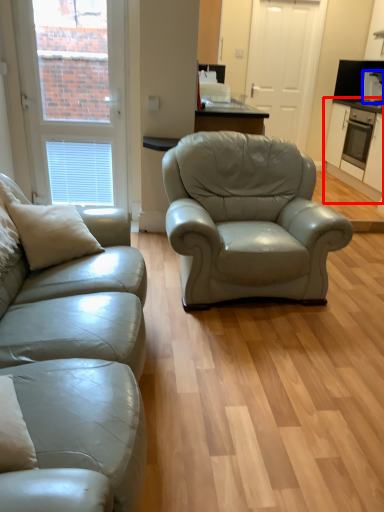
Question: Among these objects, which one is farthest to the camera, cabinetry (highlighted by a red box) or appliance (highlighted by a blue box)?

Choices:
 (A) cabinetry
 (B) appliance

Answer: (B)